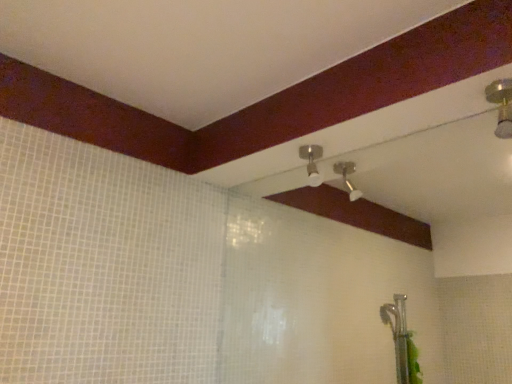
At what (x,y) coordinates should I click in order to perform the action: click on matte silver shower head at center, which ranks as the first shower in left-to-right order. Please return your answer as a coordinate pair (x, y). The width and height of the screenshot is (512, 384). Looking at the image, I should click on (312, 162).

Image resolution: width=512 pixels, height=384 pixels. What do you see at coordinates (312, 162) in the screenshot?
I see `matte silver shower head at center, acting as the second shower starting from the right` at bounding box center [312, 162].

Measure the distance between matte silver shower head at center, positioned as the second shower in front-to-back order, and camera.

They are 4.60 feet apart.

How much space does matte silver shower head at center, positioned as the second shower in front-to-back order, occupy vertically?

The height of matte silver shower head at center, positioned as the second shower in front-to-back order, is 13.67 centimeters.

You are a GUI agent. You are given a task and a screenshot of the screen. Output one action in this format:
    pyautogui.click(x=<x>, y=<y>)
    Task: Click on the gold metallic shower head at upper right, placed as the first shower when sorted from front to back
    
    Given the screenshot: What is the action you would take?
    pyautogui.click(x=501, y=105)

This screenshot has height=384, width=512. What do you see at coordinates (501, 105) in the screenshot?
I see `gold metallic shower head at upper right, placed as the first shower when sorted from front to back` at bounding box center [501, 105].

Locate an element on the screen. matte silver shower head at center, positioned as the second shower in front-to-back order is located at coordinates (312, 162).

Is gold metallic shower head at upper right, which is counted as the 2th shower, starting from the back, to the left or to the right of matte silver shower head at center, positioned as the second shower in front-to-back order, in the image?

gold metallic shower head at upper right, which is counted as the 2th shower, starting from the back, is positioned on matte silver shower head at center, positioned as the second shower in front-to-back order,'s right side.

Does gold metallic shower head at upper right, which is counted as the 2th shower, starting from the back, come behind matte silver shower head at center, which ranks as the first shower in left-to-right order?

No, the depth of gold metallic shower head at upper right, which is counted as the 2th shower, starting from the back, is less than that of matte silver shower head at center, which ranks as the first shower in left-to-right order.

Considering the points (509, 133) and (314, 155), which point is in front, point (509, 133) or point (314, 155)?

The point (509, 133) is more forward.

From the image's perspective, is gold metallic shower head at upper right, the second shower positioned from the left, positioned above or below matte silver shower head at center, which is the first shower from back to front?

gold metallic shower head at upper right, the second shower positioned from the left, is above matte silver shower head at center, which is the first shower from back to front.

From a real-world perspective, between gold metallic shower head at upper right, placed as the first shower when sorted from front to back, and matte silver shower head at center, which is the first shower from back to front, who is vertically lower?

matte silver shower head at center, which is the first shower from back to front.

Considering the relative sizes of gold metallic shower head at upper right, the second shower positioned from the left, and matte silver shower head at center, which ranks as the first shower in left-to-right order, in the image provided, is gold metallic shower head at upper right, the second shower positioned from the left, wider than matte silver shower head at center, which ranks as the first shower in left-to-right order,?

Incorrect, the width of gold metallic shower head at upper right, the second shower positioned from the left, does not surpass that of matte silver shower head at center, which ranks as the first shower in left-to-right order.

In terms of height, does gold metallic shower head at upper right, the 1th shower in the right-to-left sequence, look taller or shorter compared to matte silver shower head at center, which ranks as the first shower in left-to-right order?

Considering their sizes, gold metallic shower head at upper right, the 1th shower in the right-to-left sequence, has less height than matte silver shower head at center, which ranks as the first shower in left-to-right order.

Considering the sizes of objects gold metallic shower head at upper right, the 1th shower in the right-to-left sequence, and matte silver shower head at center, which ranks as the first shower in left-to-right order, in the image provided, who is smaller, gold metallic shower head at upper right, the 1th shower in the right-to-left sequence, or matte silver shower head at center, which ranks as the first shower in left-to-right order,?

gold metallic shower head at upper right, the 1th shower in the right-to-left sequence.

Is gold metallic shower head at upper right, the 1th shower in the right-to-left sequence, outside of matte silver shower head at center, which ranks as the first shower in left-to-right order?

Yes, gold metallic shower head at upper right, the 1th shower in the right-to-left sequence, is located beyond the bounds of matte silver shower head at center, which ranks as the first shower in left-to-right order.

Is gold metallic shower head at upper right, the 1th shower in the right-to-left sequence, far from matte silver shower head at center, which ranks as the first shower in left-to-right order?

They are positioned close to each other.

Is gold metallic shower head at upper right, the second shower positioned from the left, oriented away from matte silver shower head at center, positioned as the second shower in front-to-back order?

gold metallic shower head at upper right, the second shower positioned from the left, does not have its back to matte silver shower head at center, positioned as the second shower in front-to-back order.

Find the location of a particular element. This screenshot has height=384, width=512. shower on the right of matte silver shower head at center, positioned as the second shower in front-to-back order is located at coordinates (501, 105).

Does matte silver shower head at center, which ranks as the first shower in left-to-right order, appear on the left side of gold metallic shower head at upper right, the 1th shower in the right-to-left sequence?

Indeed, matte silver shower head at center, which ranks as the first shower in left-to-right order, is positioned on the left side of gold metallic shower head at upper right, the 1th shower in the right-to-left sequence.

Relative to gold metallic shower head at upper right, the 1th shower in the right-to-left sequence, is matte silver shower head at center, which is the first shower from back to front, in front or behind?

matte silver shower head at center, which is the first shower from back to front, is behind gold metallic shower head at upper right, the 1th shower in the right-to-left sequence.

Which is closer to the camera, [313,147] or [503,112]?

Point [313,147].

Based on the photo, from the image's perspective, is matte silver shower head at center, acting as the second shower starting from the right, located beneath gold metallic shower head at upper right, placed as the first shower when sorted from front to back?

Correct, matte silver shower head at center, acting as the second shower starting from the right, appears lower than gold metallic shower head at upper right, placed as the first shower when sorted from front to back, in the image.

From a real-world perspective, which object rests below the other?

In real-world perspective, matte silver shower head at center, which ranks as the first shower in left-to-right order, is lower.

Considering the relative sizes of matte silver shower head at center, positioned as the second shower in front-to-back order, and gold metallic shower head at upper right, placed as the first shower when sorted from front to back, in the image provided, is matte silver shower head at center, positioned as the second shower in front-to-back order, thinner than gold metallic shower head at upper right, placed as the first shower when sorted from front to back,?

No.

Is matte silver shower head at center, positioned as the second shower in front-to-back order, taller than gold metallic shower head at upper right, which is counted as the 2th shower, starting from the back?

Yes, matte silver shower head at center, positioned as the second shower in front-to-back order, is taller than gold metallic shower head at upper right, which is counted as the 2th shower, starting from the back.

Is matte silver shower head at center, which is the first shower from back to front, smaller than gold metallic shower head at upper right, the second shower positioned from the left?

Incorrect, matte silver shower head at center, which is the first shower from back to front, is not smaller in size than gold metallic shower head at upper right, the second shower positioned from the left.

Is matte silver shower head at center, which ranks as the first shower in left-to-right order, inside or outside of gold metallic shower head at upper right, which is counted as the 2th shower, starting from the back?

matte silver shower head at center, which ranks as the first shower in left-to-right order, is located beyond the bounds of gold metallic shower head at upper right, which is counted as the 2th shower, starting from the back.

Is matte silver shower head at center, which ranks as the first shower in left-to-right order, with gold metallic shower head at upper right, which is counted as the 2th shower, starting from the back?

No, matte silver shower head at center, which ranks as the first shower in left-to-right order, is not beside gold metallic shower head at upper right, which is counted as the 2th shower, starting from the back.

Is matte silver shower head at center, acting as the second shower starting from the right, aimed at gold metallic shower head at upper right, which is counted as the 2th shower, starting from the back?

No, matte silver shower head at center, acting as the second shower starting from the right, is not turned towards gold metallic shower head at upper right, which is counted as the 2th shower, starting from the back.

In the scene shown: Can you tell me how much matte silver shower head at center, acting as the second shower starting from the right, and gold metallic shower head at upper right, which is counted as the 2th shower, starting from the back, differ in facing direction?

The angle between the facing direction of matte silver shower head at center, acting as the second shower starting from the right, and the facing direction of gold metallic shower head at upper right, which is counted as the 2th shower, starting from the back, is 0.000664 degrees.

Measure the distance between matte silver shower head at center, acting as the second shower starting from the right, and gold metallic shower head at upper right, the second shower positioned from the left.

The distance of matte silver shower head at center, acting as the second shower starting from the right, from gold metallic shower head at upper right, the second shower positioned from the left, is 21.41 inches.

Identify the location of shower below the gold metallic shower head at upper right, which is counted as the 2th shower, starting from the back (from the image's perspective). (312, 162).

In the image, there is a matte silver shower head at center, acting as the second shower starting from the right. Where is `shower above it (from the image's perspective)`? shower above it (from the image's perspective) is located at coordinates (501, 105).

Where is `shower below the gold metallic shower head at upper right, the 1th shower in the right-to-left sequence (from the image's perspective)`? The height and width of the screenshot is (384, 512). shower below the gold metallic shower head at upper right, the 1th shower in the right-to-left sequence (from the image's perspective) is located at coordinates (312, 162).